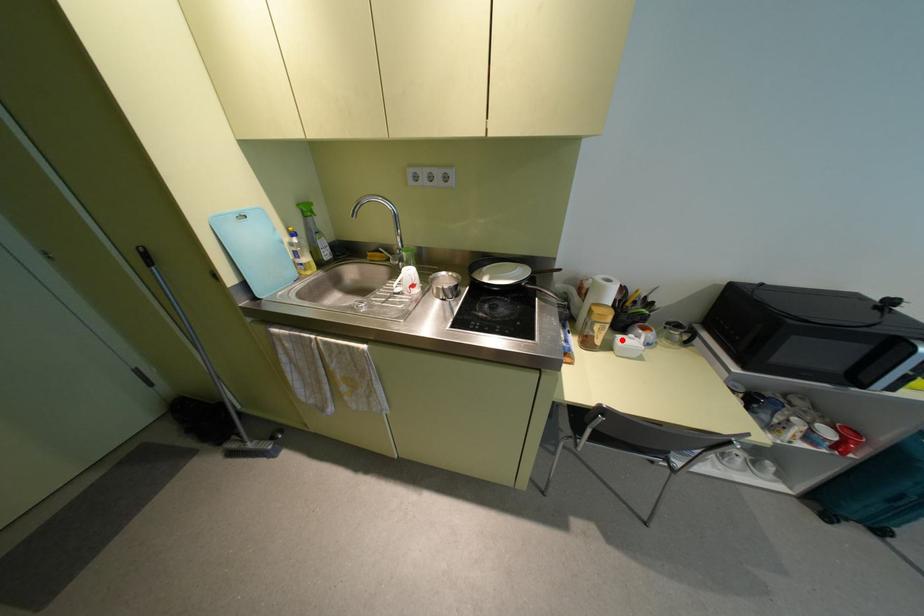
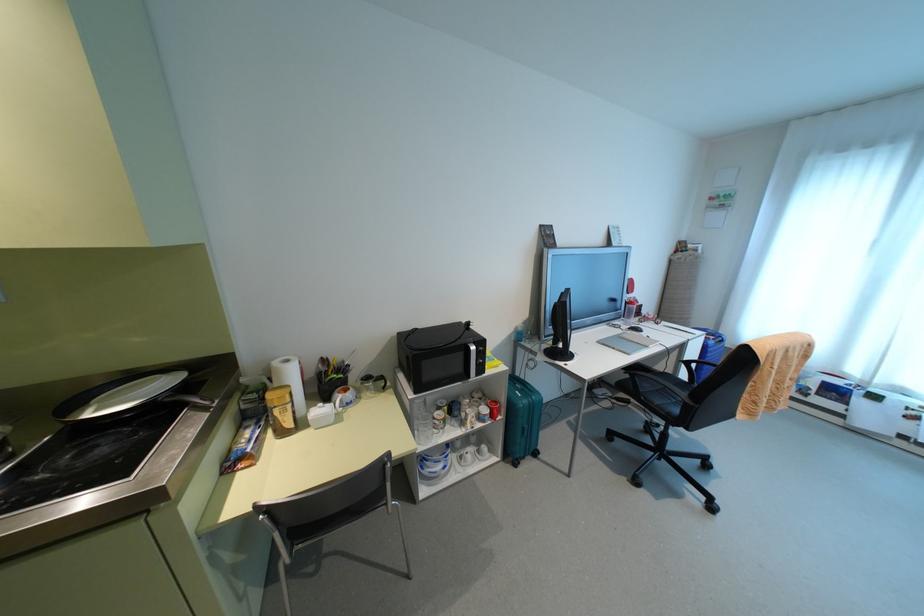
The point at the highlighted location is marked in the first image. Where is the corresponding point in the second image?

(317, 411)